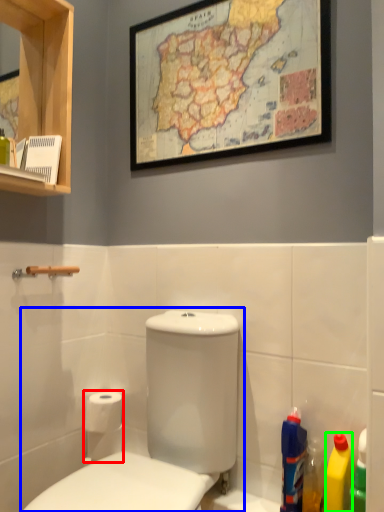
Question: Which is farther away from toilet paper (highlighted by a red box)? toilet (highlighted by a blue box) or cleaning product (highlighted by a green box)?

Choices:
 (A) toilet
 (B) cleaning product

Answer: (B)